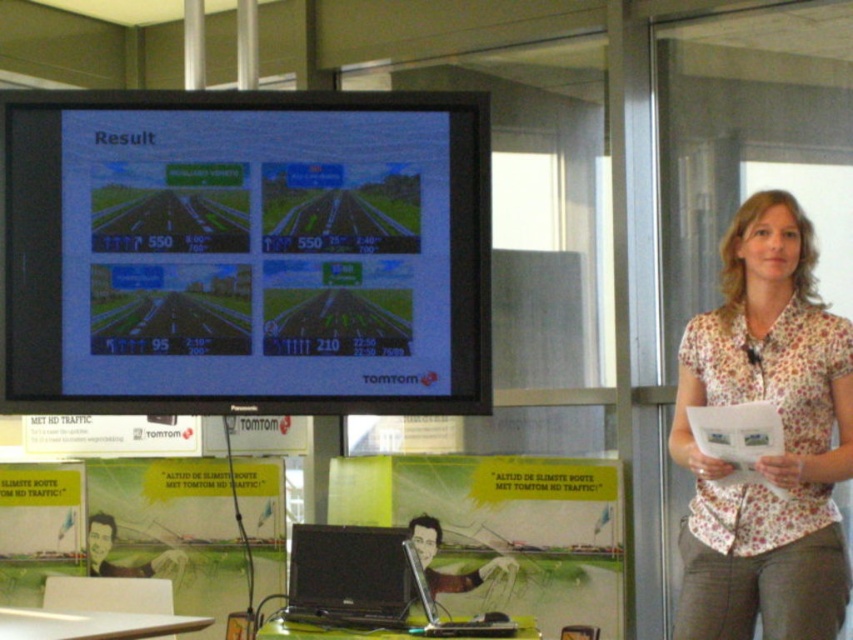
Is white floral shirt at upper right closer to camera compared to black glossy laptop at lower center?

That is False.

Does point (828, 486) lie behind point (397, 529)?

Yes, point (828, 486) is behind point (397, 529).

Locate an element on the screen. white floral shirt at upper right is located at coordinates (766, 456).

Is matte black monitor at upper left thinner than black glossy laptop at center?

In fact, matte black monitor at upper left might be wider than black glossy laptop at center.

Is matte black monitor at upper left below black glossy laptop at center?

Incorrect, matte black monitor at upper left is not positioned below black glossy laptop at center.

Is point (170, 250) closer to camera compared to point (424, 586)?

No.

Where is `matte black monitor at upper left`? The image size is (853, 640). matte black monitor at upper left is located at coordinates (244, 252).

Find the location of a particular element. This screenshot has height=640, width=853. matte black monitor at upper left is located at coordinates (244, 252).

Who is more forward, (38, 282) or (314, 589)?

Point (314, 589)

Does point (62, 368) come in front of point (291, 545)?

No, it is not.

What are the coordinates of `matte black monitor at upper left` in the screenshot? It's located at (244, 252).